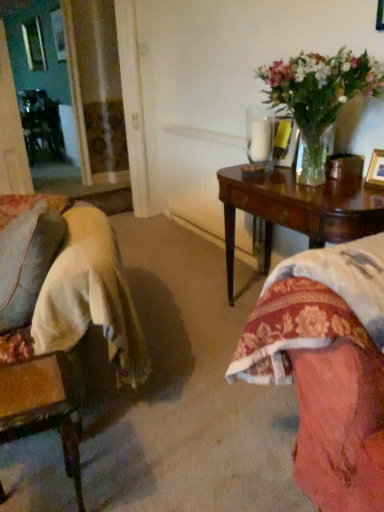
Question: Are clear glass vase at upper right and white textured radiator at center far apart?

Choices:
 (A) yes
 (B) no

Answer: (A)

Question: Is clear glass vase at upper right to the right of white textured radiator at center from the viewer's perspective?

Choices:
 (A) no
 (B) yes

Answer: (B)

Question: Can you confirm if clear glass vase at upper right is thinner than white textured radiator at center?

Choices:
 (A) no
 (B) yes

Answer: (A)

Question: Is clear glass vase at upper right behind white textured radiator at center?

Choices:
 (A) no
 (B) yes

Answer: (A)

Question: Considering the relative sizes of clear glass vase at upper right and white textured radiator at center in the image provided, is clear glass vase at upper right wider than white textured radiator at center?

Choices:
 (A) no
 (B) yes

Answer: (B)

Question: From the image's perspective, relative to wooden picture frame at upper right, is wooden swivel chair at lower left above or below?

Choices:
 (A) below
 (B) above

Answer: (A)

Question: Considering the relative positions of wooden swivel chair at lower left and wooden picture frame at upper right in the image provided, is wooden swivel chair at lower left to the left or to the right of wooden picture frame at upper right?

Choices:
 (A) right
 (B) left

Answer: (B)

Question: Relative to wooden picture frame at upper right, is wooden swivel chair at lower left in front or behind?

Choices:
 (A) behind
 (B) front

Answer: (B)

Question: From a real-world perspective, is wooden swivel chair at lower left physically located above or below wooden picture frame at upper right?

Choices:
 (A) below
 (B) above

Answer: (A)

Question: From the image's perspective, is wooden swivel chair at lower left above or below clear glass vase at upper right?

Choices:
 (A) above
 (B) below

Answer: (B)

Question: Is wooden swivel chair at lower left wider or thinner than clear glass vase at upper right?

Choices:
 (A) thin
 (B) wide

Answer: (A)

Question: Is point (3, 422) positioned closer to the camera than point (370, 90)?

Choices:
 (A) closer
 (B) farther

Answer: (A)

Question: Visually, is wooden swivel chair at lower left positioned to the left or to the right of clear glass vase at upper right?

Choices:
 (A) left
 (B) right

Answer: (A)

Question: From their relative heights in the image, would you say clear glass vase at upper right is taller or shorter than mahogany wood table at right?

Choices:
 (A) short
 (B) tall

Answer: (A)

Question: Which is correct: clear glass vase at upper right is inside mahogany wood table at right, or outside of it?

Choices:
 (A) inside
 (B) outside

Answer: (B)